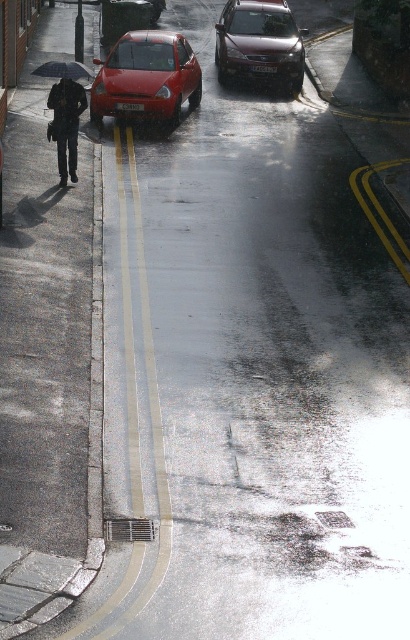
Looking at this image, measure the distance between matte black jacket at left and black matte umbrella at left.

matte black jacket at left and black matte umbrella at left are 4.45 feet apart from each other.

Between matte black jacket at left and black matte umbrella at left, which one is positioned higher?

black matte umbrella at left is higher up.

Identify the location of matte black jacket at left. This screenshot has width=410, height=640. (66, 124).

From the picture: Can you confirm if shiny red car at center is positioned to the right of matte black jacket at left?

Yes, shiny red car at center is to the right of matte black jacket at left.

Can you confirm if shiny red car at center is bigger than matte black jacket at left?

Yes, shiny red car at center is bigger than matte black jacket at left.

Find the location of a particular element. shiny red car at center is located at coordinates (145, 77).

Locate an element on the screen. The image size is (410, 640). shiny red car at center is located at coordinates (145, 77).

Who is more forward, (x=56, y=275) or (x=248, y=76)?

Point (x=56, y=275) is more forward.

Between point (16, 102) and point (234, 45), which one is positioned behind?

The point (234, 45) is more distant.

This screenshot has height=640, width=410. I want to click on gray asphalt pavement at left, so [x=47, y=356].